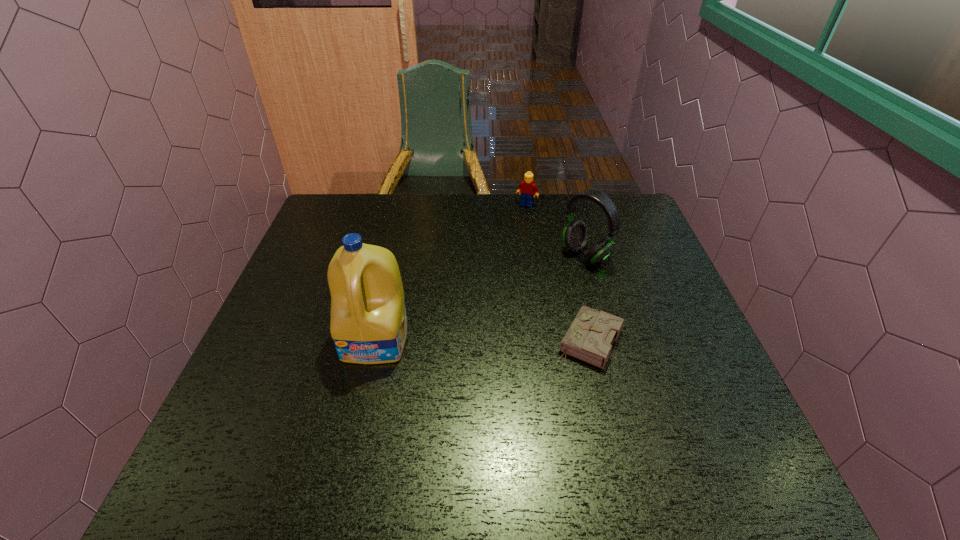
Identify the location of the leftmost object. (368, 324).

You are a GUI agent. You are given a task and a screenshot of the screen. Output one action in this format:
    pyautogui.click(x=<x>, y=<y>)
    Task: Click on the detergent
    This screenshot has height=540, width=960.
    Given the screenshot: What is the action you would take?
    pyautogui.click(x=368, y=324)

At what (x,y) coordinates should I click in order to perform the action: click on the shortest object. Please return your answer as a coordinate pair (x, y). The height and width of the screenshot is (540, 960). Looking at the image, I should click on (589, 338).

The width and height of the screenshot is (960, 540). In order to click on the third tallest object in this screenshot , I will do `click(527, 188)`.

The width and height of the screenshot is (960, 540). I want to click on the farthest object, so click(x=527, y=188).

Image resolution: width=960 pixels, height=540 pixels. What are the coordinates of `headset` in the screenshot? It's located at (575, 237).

Where is `the second farthest object`? This screenshot has width=960, height=540. the second farthest object is located at coordinates (575, 237).

You are a GUI agent. You are given a task and a screenshot of the screen. Output one action in this format:
    pyautogui.click(x=<x>, y=<y>)
    Task: Click on the vacant space located 0.090m on the label of the detergent
    This screenshot has height=540, width=960.
    Given the screenshot: What is the action you would take?
    pyautogui.click(x=363, y=402)

This screenshot has height=540, width=960. Identify the location of blank space located 0.180m on the back of the diary. (571, 267).

This screenshot has height=540, width=960. What are the coordinates of `free space located 0.330m on the front-facing side of the Lego` in the screenshot? It's located at (492, 269).